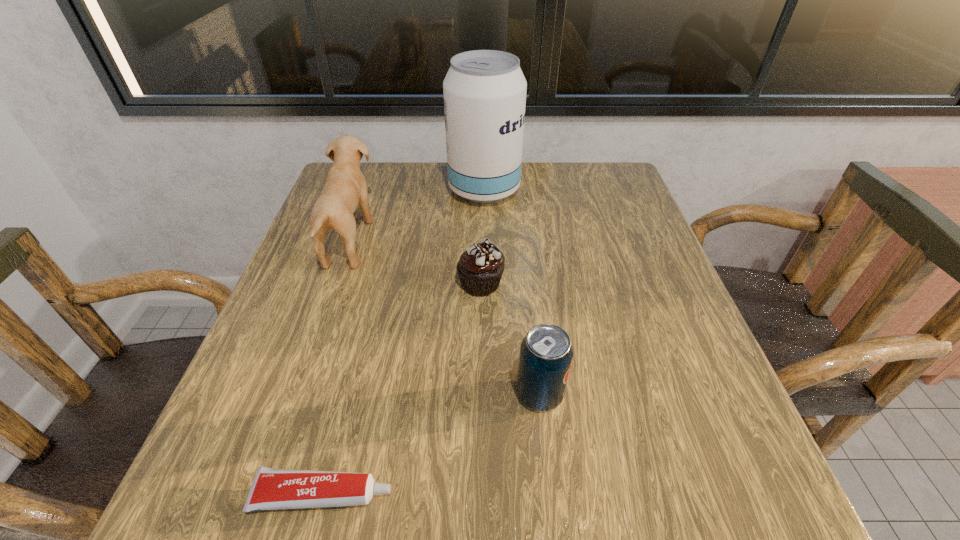
You are a GUI agent. You are given a task and a screenshot of the screen. Output one action in this format:
    pyautogui.click(x=<x>, y=<y>)
    Task: Click on the vacant space located 0.280m on the front of the fourth tallest object
    The height and width of the screenshot is (540, 960).
    Given the screenshot: What is the action you would take?
    pyautogui.click(x=481, y=443)

This screenshot has width=960, height=540. I want to click on vacant space situated at the nozzle of the shortest object, so click(x=431, y=495).

Identify the location of alcohol present at the far edge. (484, 91).

Where is `puppy situated at the far edge`? puppy situated at the far edge is located at coordinates (346, 187).

Find the location of a particular element. The height and width of the screenshot is (540, 960). object present at the near edge is located at coordinates (272, 489).

Locate an element on the screen. This screenshot has height=540, width=960. puppy located at the left edge is located at coordinates (346, 187).

You are a GUI agent. You are given a task and a screenshot of the screen. Output one action in this format:
    pyautogui.click(x=<x>, y=<y>)
    Task: Click on the toothpaste situated at the left edge
    The image size is (960, 540).
    Given the screenshot: What is the action you would take?
    pyautogui.click(x=272, y=489)

Where is `object situated at the far left corner`? object situated at the far left corner is located at coordinates (346, 187).

Find the location of a particular element. This screenshot has width=960, height=540. object located at the near left corner is located at coordinates (272, 489).

In the image, there is a desktop. Where is `vacant region at the far edge`? vacant region at the far edge is located at coordinates (451, 191).